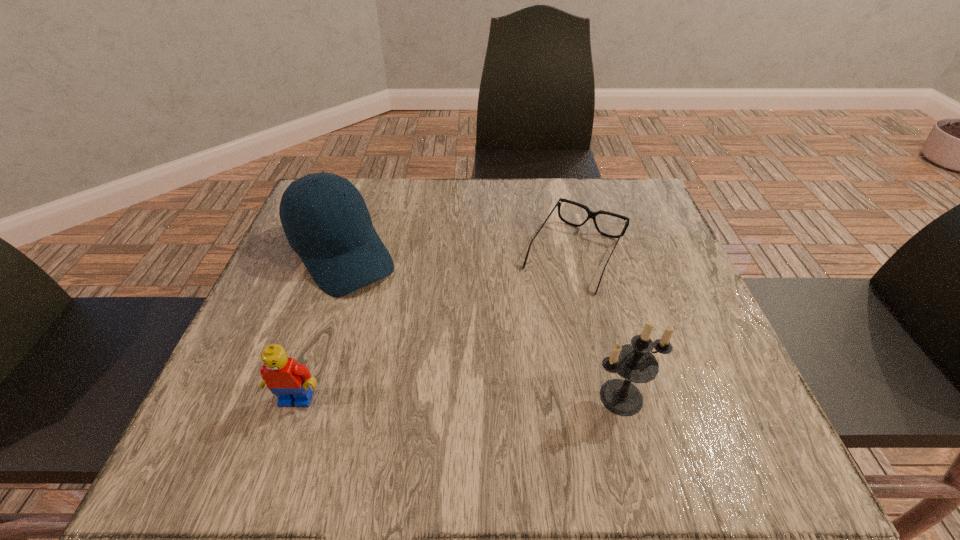
Identify the location of free space between the spectacles and the Lego. The height and width of the screenshot is (540, 960). (436, 327).

Locate an element on the screen. The width and height of the screenshot is (960, 540). empty space between the baseball cap and the second shortest object is located at coordinates (319, 327).

The width and height of the screenshot is (960, 540). What are the coordinates of `unoccupied position between the Lego and the shortest object` in the screenshot? It's located at (436, 327).

You are a GUI agent. You are given a task and a screenshot of the screen. Output one action in this format:
    pyautogui.click(x=<x>, y=<y>)
    Task: Click on the empty location between the candle holder and the shortest object
    
    Given the screenshot: What is the action you would take?
    pyautogui.click(x=598, y=326)

Identify the location of free area in between the candle holder and the baseball cap. The width and height of the screenshot is (960, 540). pyautogui.click(x=482, y=326).

Where is `empty space that is in between the baseball cap and the Lego`? empty space that is in between the baseball cap and the Lego is located at coordinates (319, 327).

Image resolution: width=960 pixels, height=540 pixels. Find the location of `unoccupied position between the candle holder and the baseball cap`. unoccupied position between the candle holder and the baseball cap is located at coordinates (482, 326).

This screenshot has width=960, height=540. In order to click on free spot between the shortest object and the Lego in this screenshot , I will do `click(436, 327)`.

The width and height of the screenshot is (960, 540). I want to click on empty space between the baseball cap and the candle holder, so click(482, 326).

Identify the location of object that is the third closest to the baseball cap. The height and width of the screenshot is (540, 960). (635, 362).